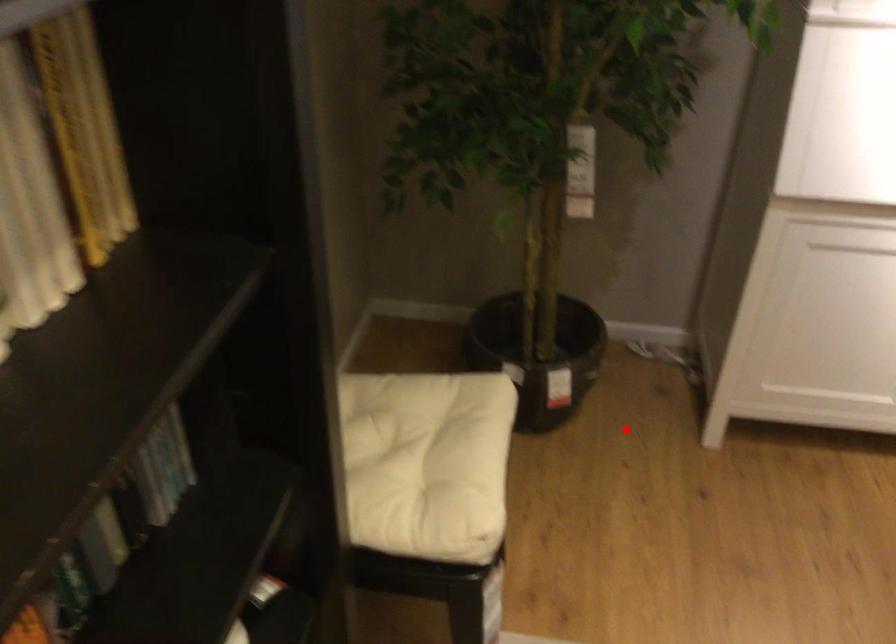
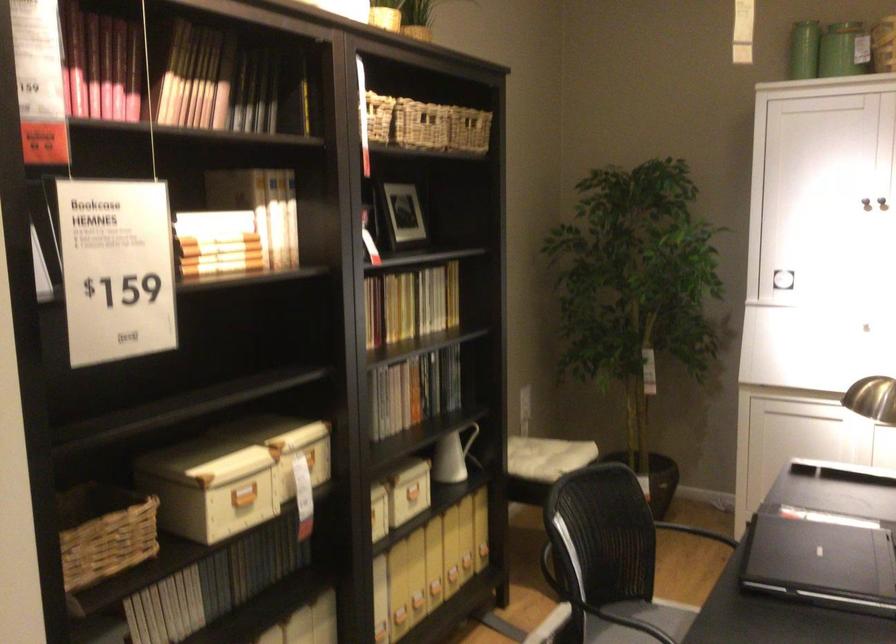
Locate, in the second image, the point that corresponds to the highlighted location in the first image.

(695, 532)